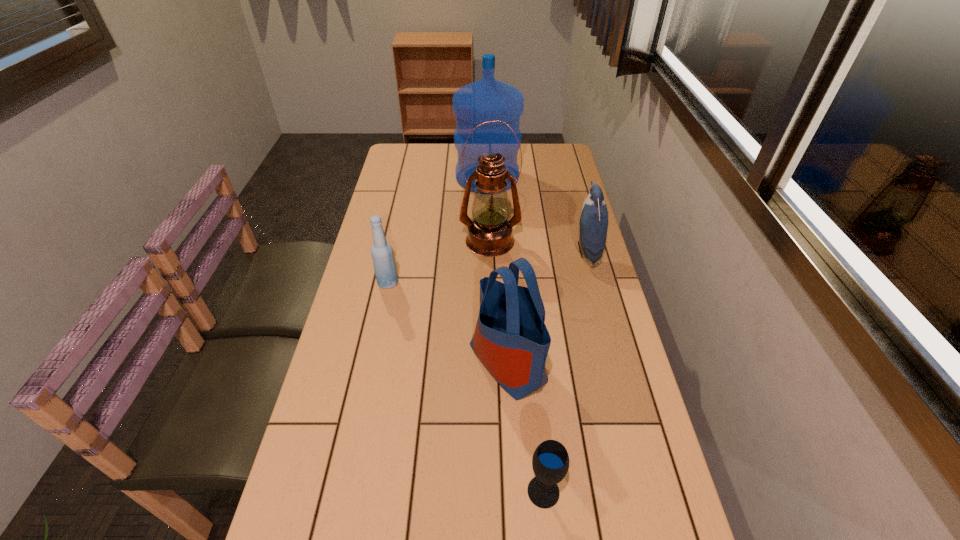
At what (x,y) coordinates should I click in order to perform the action: click on vacant space at the left edge of the desktop. Please return your answer as a coordinate pair (x, y). The height and width of the screenshot is (540, 960). Looking at the image, I should click on (406, 249).

Where is `free spot at the right edge of the desktop`? Image resolution: width=960 pixels, height=540 pixels. free spot at the right edge of the desktop is located at coordinates (639, 435).

Find the location of a particular element. Image resolution: width=960 pixels, height=540 pixels. free spot between the fourth farthest object and the oil lamp is located at coordinates (439, 262).

Where is `free area in between the second nearest object and the shortest object`? The width and height of the screenshot is (960, 540). free area in between the second nearest object and the shortest object is located at coordinates (525, 427).

Locate an element on the screen. vacant point located between the nearest object and the bird is located at coordinates (564, 371).

The image size is (960, 540). I want to click on free space that is in between the fourth shortest object and the bird, so click(x=547, y=306).

Locate an element on the screen. This screenshot has height=540, width=960. free space between the leftmost object and the wineglass is located at coordinates (466, 387).

Where is `object that is the fourth closest to the third tallest object`? Image resolution: width=960 pixels, height=540 pixels. object that is the fourth closest to the third tallest object is located at coordinates (489, 232).

In order to click on the closest object to the nearest object in this screenshot , I will do point(511,339).

Locate an element on the screen. The height and width of the screenshot is (540, 960). blank space that satisfies the following two spatial constraints: 1. on the front side of the farthest object; 2. on the right side of the wineglass is located at coordinates (494, 491).